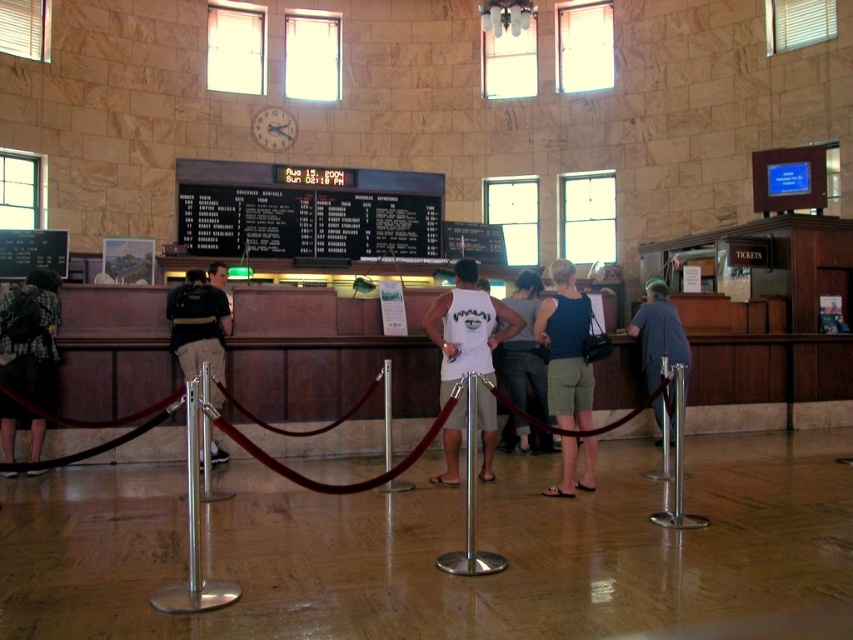
You are a customer in the train station ticket office. You see two shirts displayed on mannequins near the counter. The white matte tank top at center and the black fabric shirt at left. Which shirt takes up more space visually?

The white matte tank top at center is larger in size than the black fabric shirt at left, so it takes up more visual space.

You are standing at the point marked as point [403,214] in the train station ticket office. You want to take a photo of the entire counter and the digital display board above it. Can you do this without moving from your current position?

Yes, because the distance between you and the camera is 13.81 meters, which allows you to capture the entire counter and digital display board in your photo without needing to move.

Based on the photo, you are a customer in the train station ticket office and you want to locate the blue cotton tank top at center. Where exactly is it located in the room?

The blue cotton tank top at center is located at the point with coordinates 0.547 on the x axis and 0.665 on the y axis.